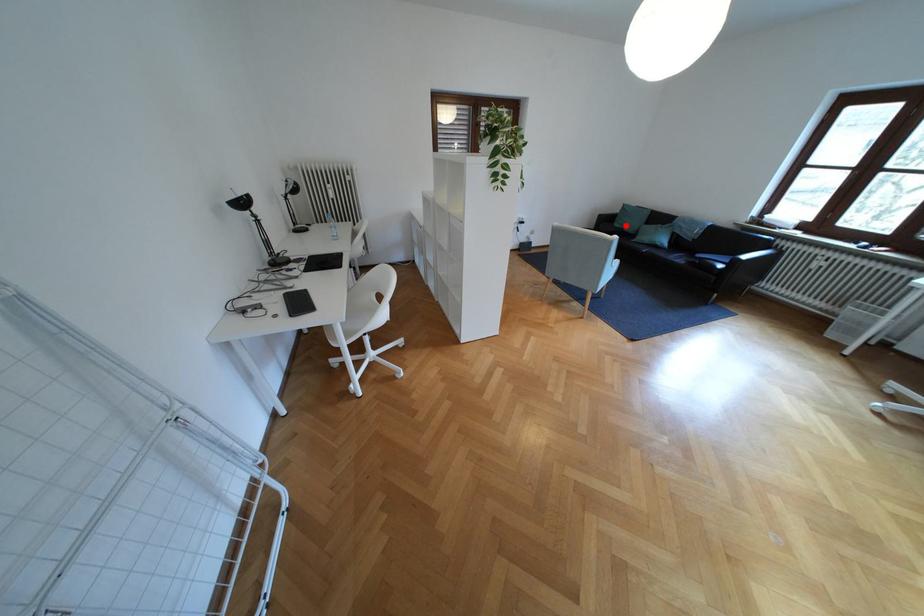
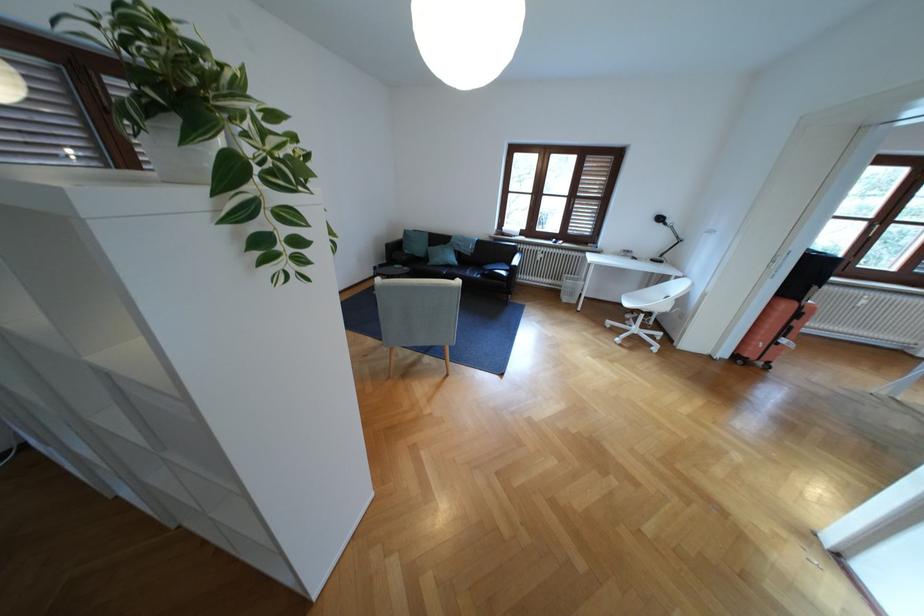
The point at the highlighted location is marked in the first image. Where is the corresponding point in the second image?

(417, 252)